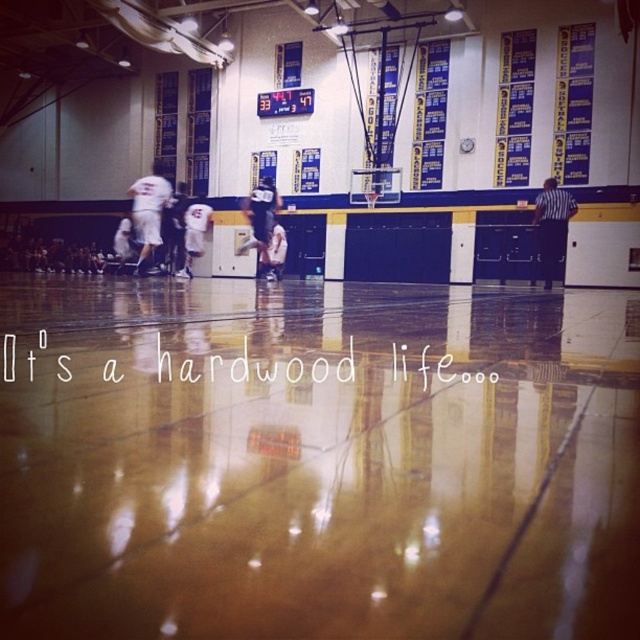
Can you confirm if white jersey basketball players at center is positioned to the right of white jersey at left?

Correct, you'll find white jersey basketball players at center to the right of white jersey at left.

Where is `white jersey basketball players at center`? This screenshot has width=640, height=640. white jersey basketball players at center is located at coordinates (259, 216).

Does white jersey at left have a greater height compared to black striped shirt at right?

Indeed, white jersey at left has a greater height compared to black striped shirt at right.

Consider the image. Is white jersey at left bigger than black striped shirt at right?

Correct, white jersey at left is larger in size than black striped shirt at right.

Who is more forward, (x=136, y=218) or (x=557, y=224)?

Point (x=136, y=218) is in front.

At what (x,y) coordinates should I click in order to perform the action: click on white jersey at left. Please return your answer as a coordinate pair (x, y). The image size is (640, 640). Looking at the image, I should click on (148, 211).

Is point (166, 180) closer to viewer compared to point (248, 196)?

No, it is behind (248, 196).

In the scene shown: Between white jersey at left and white jersey at center, which one appears on the left side from the viewer's perspective?

white jersey at left is more to the left.

Find the location of `white jersey at left`. white jersey at left is located at coordinates (148, 211).

Identify the location of white jersey at left. (148, 211).